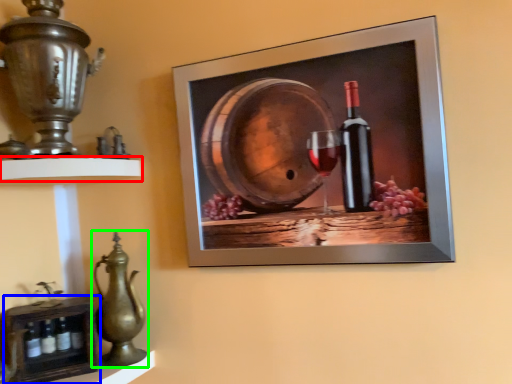
Question: Considering the real-world distances, which object is closest to shelf (highlighted by a red box)? shelf (highlighted by a blue box) or jug (highlighted by a green box).

Choices:
 (A) shelf
 (B) jug

Answer: (B)